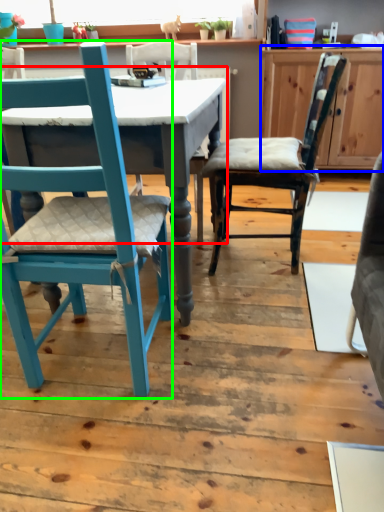
Question: Considering the real-world distances, which object is farthest from table (highlighted by a red box)? cabinetry (highlighted by a blue box) or chair (highlighted by a green box)?

Choices:
 (A) cabinetry
 (B) chair

Answer: (A)